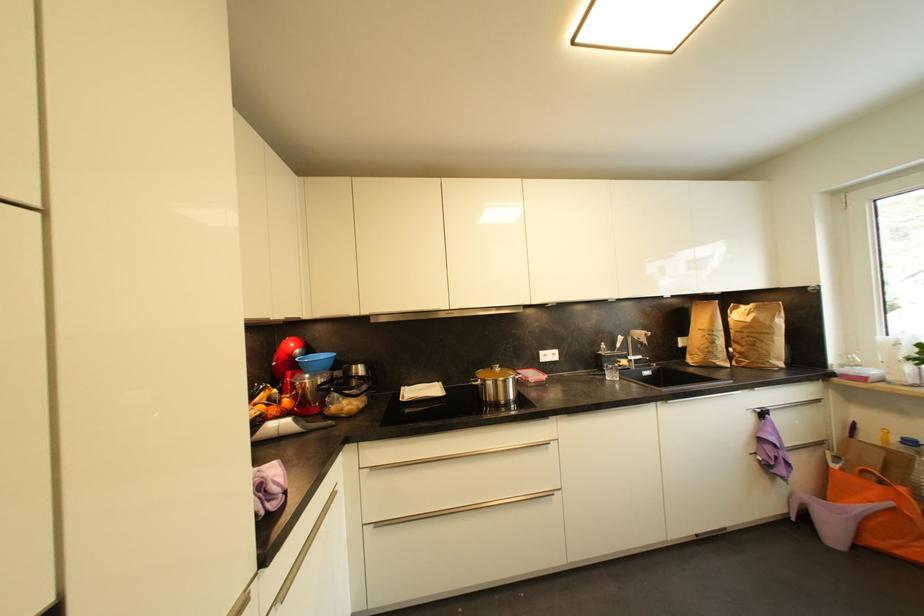
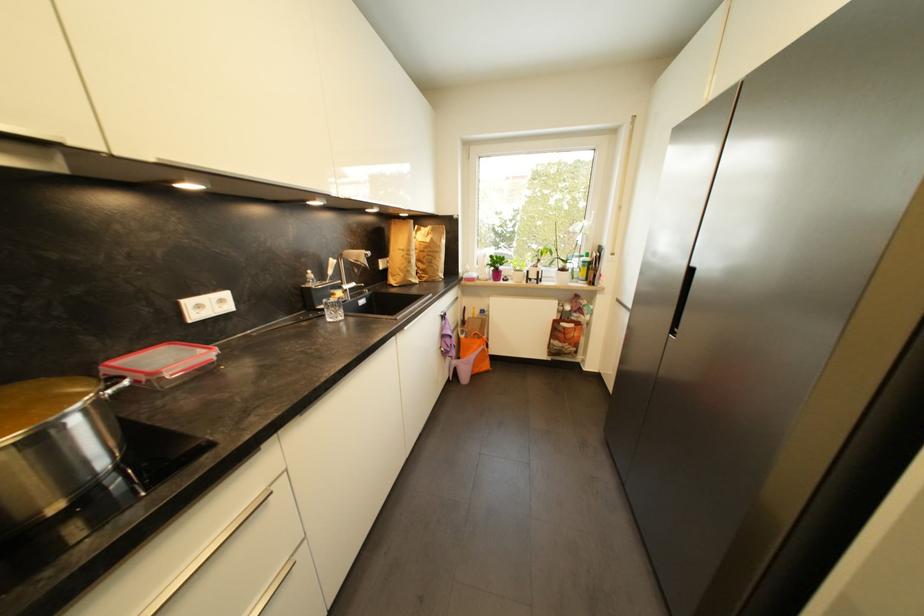
Locate, in the second image, the point that corresponds to point 558,355 in the first image.

(226, 302)